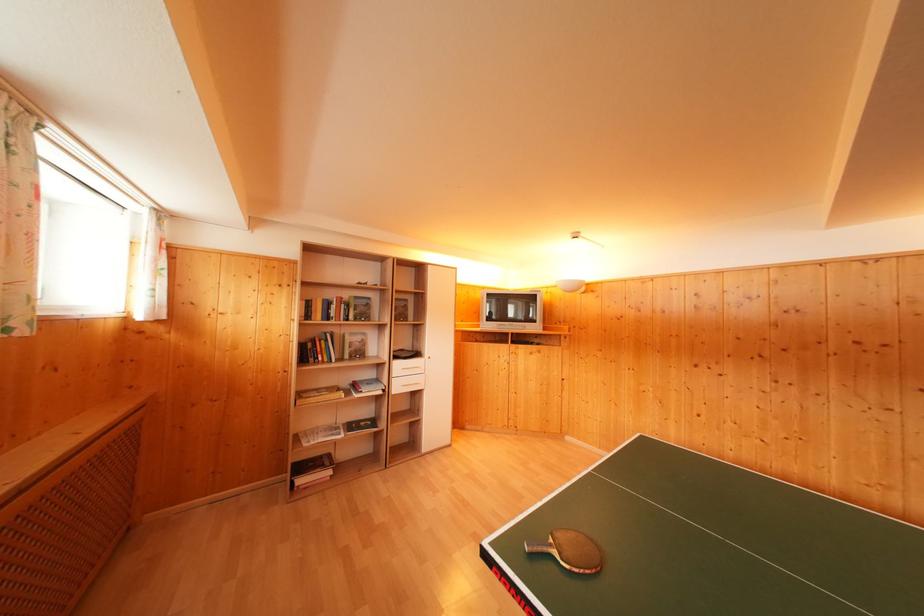
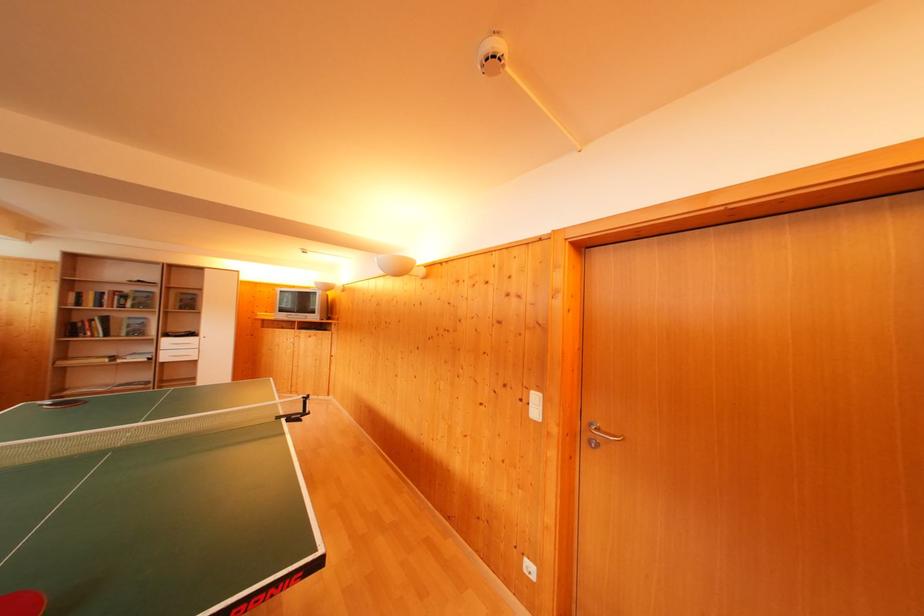
The point at [311,359] is marked in the first image. Where is the corresponding point in the second image?

(76, 334)